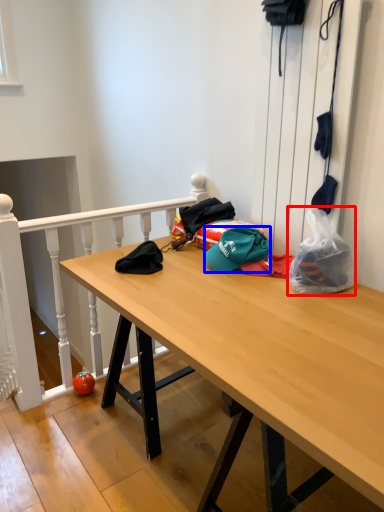
Question: Which point is closer to the camera, plastic bag (highlighted by a red box) or hat (highlighted by a blue box)?

Choices:
 (A) plastic bag
 (B) hat

Answer: (A)